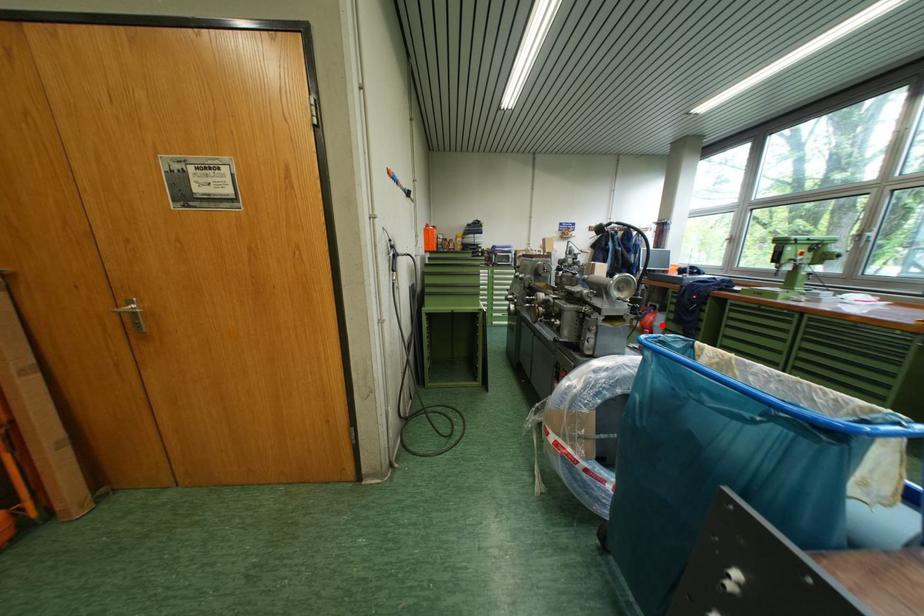
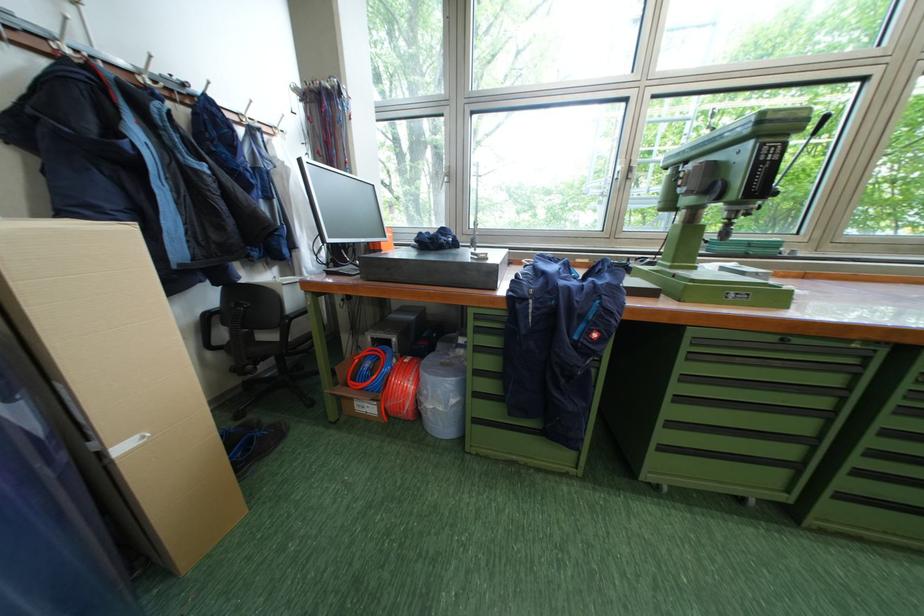
In the second image, find the point that corresponds to the highlighted location in the first image.

(427, 405)